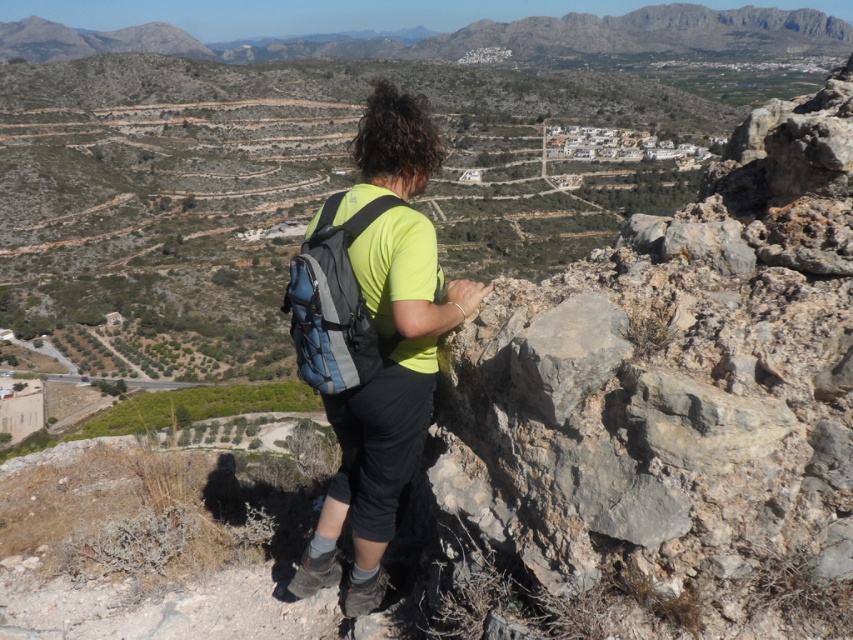
I want to click on gray rough rock at center-right, so click(x=666, y=412).

Locate an element on the screen. The width and height of the screenshot is (853, 640). gray rough rock at center-right is located at coordinates (666, 412).

Where is `gray rough rock at center-right`? gray rough rock at center-right is located at coordinates (666, 412).

Is gray rough rock at center-right below matte blue backpack at center?

Indeed, gray rough rock at center-right is positioned under matte blue backpack at center.

Is point (740, 545) positioned in front of point (305, 262)?

Yes, it is.

The height and width of the screenshot is (640, 853). I want to click on gray rough rock at center-right, so click(x=666, y=412).

The width and height of the screenshot is (853, 640). Describe the element at coordinates (372, 337) in the screenshot. I see `green matte shirt at center` at that location.

Between point (357, 477) and point (358, 225), which one is positioned in front?

Point (358, 225) is more forward.

The width and height of the screenshot is (853, 640). Identify the location of green matte shirt at center. point(372,337).